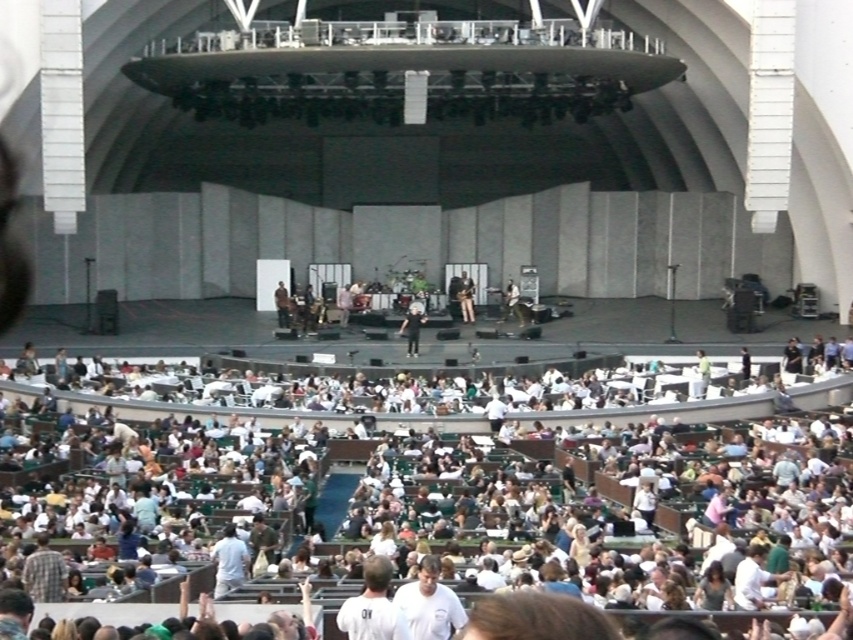
Question: Is shiny black guitar at center further to the viewer compared to dark brown leather jacket at center?

Choices:
 (A) no
 (B) yes

Answer: (A)

Question: Based on their relative distances, which object is farther from the dark brown leather jacket at center?

Choices:
 (A) white fabric seats at lower center
 (B) white shirt at center
 (C) shiny black guitar at center

Answer: (A)

Question: Can you confirm if white fabric seats at lower center is bigger than shiny black guitar at center?

Choices:
 (A) yes
 (B) no

Answer: (A)

Question: Which object is closer to the camera taking this photo?

Choices:
 (A) white fabric seats at lower center
 (B) white shirt at center
 (C) shiny black guitar at center
 (D) black fabric shirt at center

Answer: (A)

Question: Is white shirt at center positioned behind dark brown leather jacket at center?

Choices:
 (A) yes
 (B) no

Answer: (A)

Question: Estimate the real-world distances between objects in this image. Which object is farther from the dark brown leather jacket at center?

Choices:
 (A) black fabric shirt at center
 (B) white shirt at center

Answer: (B)